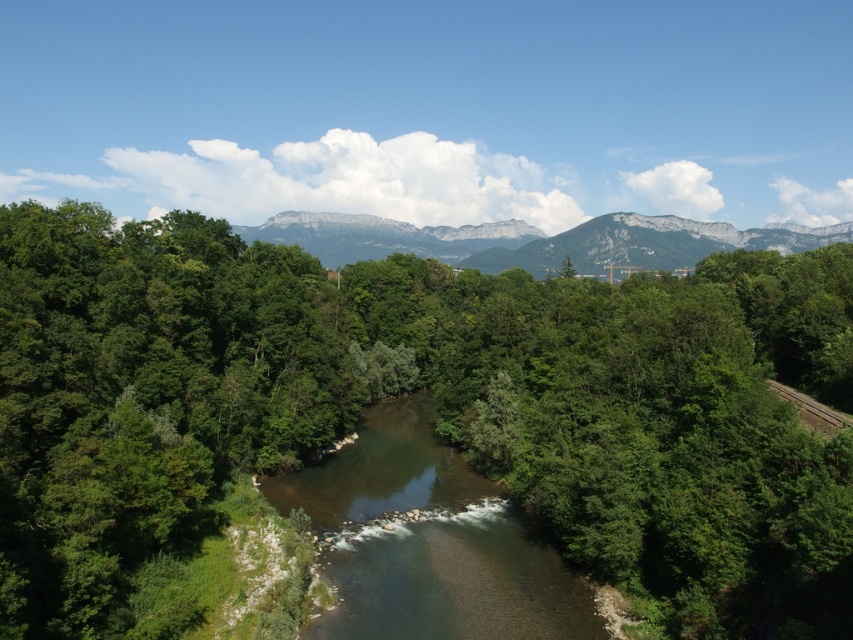
Is point (606, 240) farther from camera compared to point (799, 410)?

Yes, point (606, 240) is behind point (799, 410).

Does rocky gray mountain at center have a greater height compared to brown wooden train track at right?

Correct, rocky gray mountain at center is much taller as brown wooden train track at right.

Is point (363, 243) positioned before point (851, 426)?

No.

Locate an element on the screen. This screenshot has height=640, width=853. rocky gray mountain at center is located at coordinates (535, 241).

Can you confirm if green leafy forest at center is positioned to the right of brown wooden train track at right?

Incorrect, green leafy forest at center is not on the right side of brown wooden train track at right.

Does green leafy forest at center appear on the left side of brown wooden train track at right?

Correct, you'll find green leafy forest at center to the left of brown wooden train track at right.

The height and width of the screenshot is (640, 853). What are the coordinates of `green leafy forest at center` in the screenshot? It's located at (436, 401).

Is green leafy forest at center wider than clear water stream at center?

Yes.

Locate an element on the screen. The height and width of the screenshot is (640, 853). green leafy forest at center is located at coordinates (436, 401).